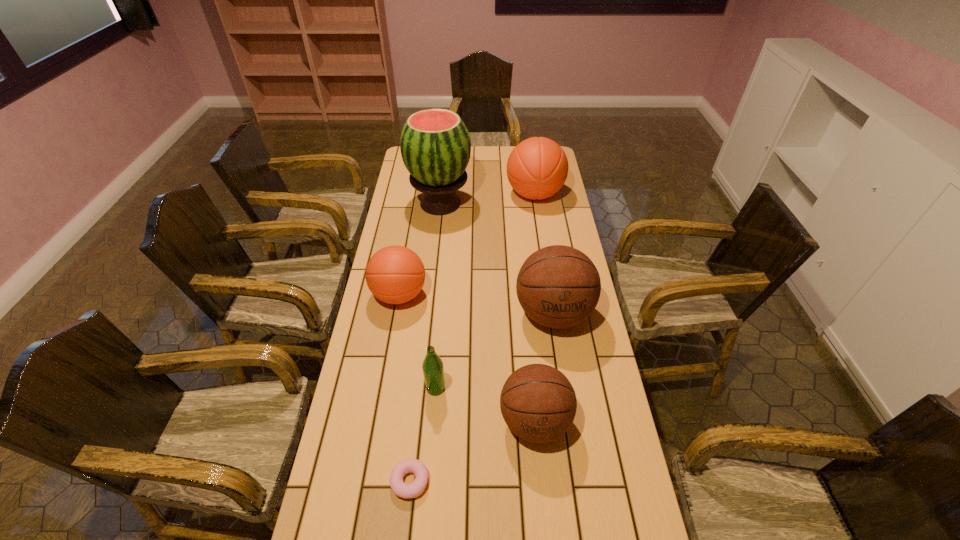
You are a GUI agent. You are given a task and a screenshot of the screen. Output one action in this format:
    pyautogui.click(x=<x>, y=<y>)
    Task: Click on the basketball at the left edge
    The image size is (960, 540).
    Given the screenshot: What is the action you would take?
    pyautogui.click(x=395, y=274)

In order to click on doughnut present at the left edge in this screenshot , I will do click(x=410, y=465).

Identify the location of free spot at the far edge of the desktop. (505, 160).

Find the location of `vacant space at the left edge of the desktop`. vacant space at the left edge of the desktop is located at coordinates (394, 329).

The height and width of the screenshot is (540, 960). What are the coordinates of `free space at the right edge of the desktop` in the screenshot? It's located at (627, 496).

Identify the location of free space between the tallest object and the farther brown basketball. (496, 259).

Locate an element on the screen. free space between the left orange basketball and the nearest basketball is located at coordinates (468, 358).

Image resolution: width=960 pixels, height=540 pixels. Identify the location of empty space that is in between the bigger orange basketball and the green watermelon. (488, 199).

At what (x,y) coordinates should I click in order to perform the action: click on vacant space that is in between the doughnut and the green bottle. Please return your answer as a coordinate pair (x, y). The image size is (960, 540). Looking at the image, I should click on (422, 435).

Find the location of a particular element. This screenshot has width=960, height=540. vacant point located between the farthest basketball and the nearest object is located at coordinates (472, 338).